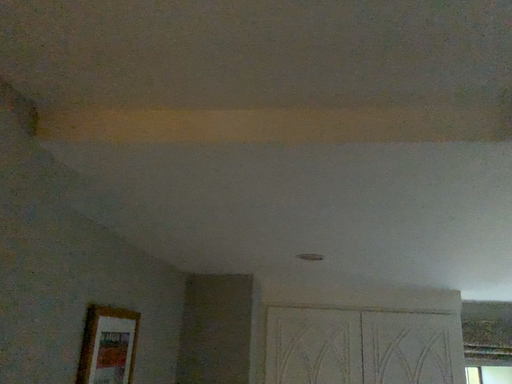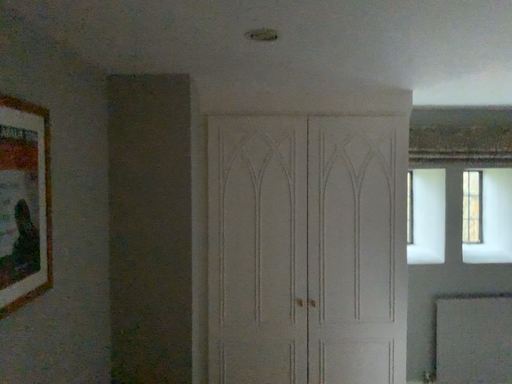
Question: Which way did the camera rotate in the video?

Choices:
 (A) rotated downward
 (B) rotated upward

Answer: (A)